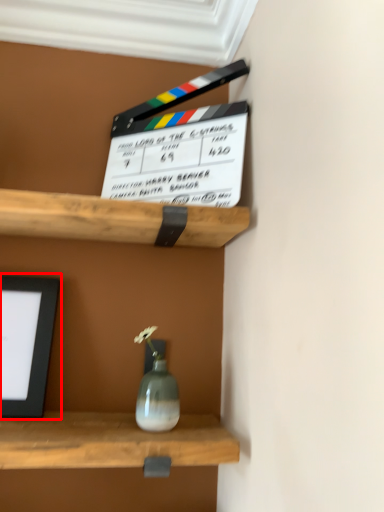
Question: Observing the image, what is the correct spatial positioning of picture frame (annotated by the red box) in reference to window frame?

Choices:
 (A) left
 (B) right

Answer: (A)